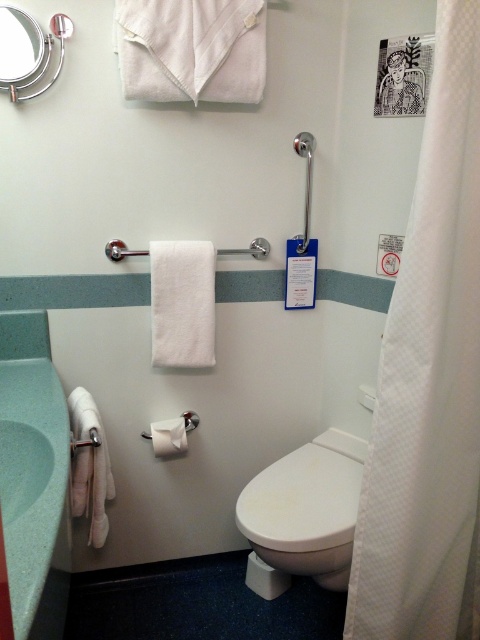
You are a maintenance worker who needs to inspect the white textured shower curtain at right. The safety protocol requires that you maintain a minimum distance of 1 meter from the curtain while inspecting. Can you safely perform the inspection from your current position?

The white textured shower curtain at right is 1.07 meters from camera, so yes, you can safely perform the inspection from your current position as the distance meets the 1 meter requirement.

Please provide the coordinates of the white glossy toilet at center in the bathroom scene described. The scene has white walls with a light teal section near the bottom, a modern sink on the left, and a toilet in the center with a grab bar above it. You must use the exact object label provided in the Objects section.

The white glossy toilet at center is located at coordinates point (305, 509).

You are trying to reach the white soft towel at left to dry your hands. However, the white textured shower curtain at right is blocking your access. Can you move the shower curtain to get to the towel?

The white textured shower curtain at right is positioned over the white soft towel at left, so you would need to move the shower curtain first to access the towel.